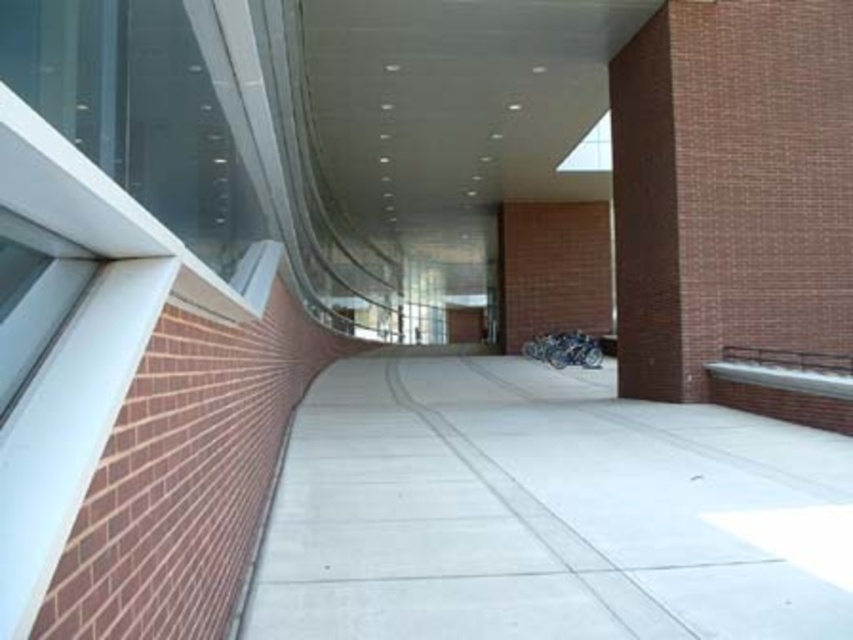
You are a delivery person carrying a large package that requires moving through the corridor. You see the concrete at center and the transparent glass window at upper center. Which object should you avoid bumping into to prevent damage to your package?

You should avoid bumping into the transparent glass window at upper center because it is positioned to the right of the concrete at center, making it more likely to be in your path if you are moving forward. Glass is also more fragile than concrete, so it is more prone to damage from collisions.

You are a delivery person carrying a large box that is 1.5 meters wide. You need to pass through the corridor shown in the image. Can you fit through the space between the brown brick pillar at right and the transparent glass window at upper center?

The brown brick pillar at right has a lesser width compared to transparent glass window at upper center. However, the width of the space between them is not specified in the provided information. Therefore, it is uncertain whether the 1.5 meter wide box can pass through.

You are standing at the point labeled point [546,513] in the corridor. What surface are you standing on?

You are standing on concrete at center, as the point [546,513] is on concrete at center.